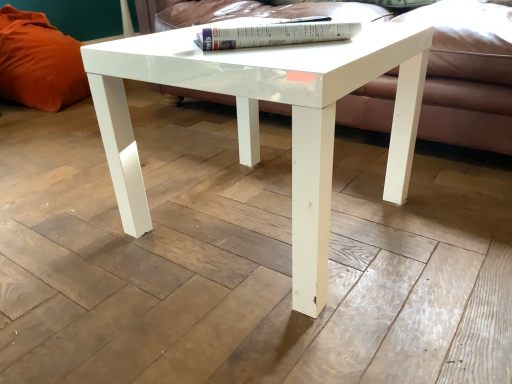
Question: Is matte white couch at center further to camera compared to white glossy book at upper center?

Choices:
 (A) yes
 (B) no

Answer: (A)

Question: From a real-world perspective, is matte white couch at center under white glossy book at upper center?

Choices:
 (A) yes
 (B) no

Answer: (A)

Question: Can you confirm if matte white couch at center is wider than white glossy book at upper center?

Choices:
 (A) yes
 (B) no

Answer: (A)

Question: Can you confirm if matte white couch at center is bigger than white glossy book at upper center?

Choices:
 (A) no
 (B) yes

Answer: (B)

Question: Does matte white couch at center have a smaller size compared to white glossy book at upper center?

Choices:
 (A) no
 (B) yes

Answer: (A)

Question: From the image's perspective, is white glossy book at upper center located above or below matte white couch at center?

Choices:
 (A) above
 (B) below

Answer: (B)

Question: Considering their positions, is white glossy book at upper center located in front of or behind matte white couch at center?

Choices:
 (A) behind
 (B) front

Answer: (B)

Question: In terms of height, does white glossy book at upper center look taller or shorter compared to matte white couch at center?

Choices:
 (A) short
 (B) tall

Answer: (A)

Question: Is point (260, 23) closer or farther from the camera than point (199, 6)?

Choices:
 (A) closer
 (B) farther

Answer: (A)

Question: Looking at the image, does matte white couch at center seem bigger or smaller compared to white glossy book at upper center?

Choices:
 (A) small
 (B) big

Answer: (B)

Question: Considering the relative positions of matte white couch at center and white glossy book at upper center in the image provided, is matte white couch at center to the left or to the right of white glossy book at upper center?

Choices:
 (A) left
 (B) right

Answer: (B)

Question: From the image's perspective, is matte white couch at center positioned above or below white glossy book at upper center?

Choices:
 (A) above
 (B) below

Answer: (A)

Question: From a real-world perspective, relative to white glossy book at upper center, is matte white couch at center vertically above or below?

Choices:
 (A) below
 (B) above

Answer: (A)

Question: From the image's perspective, is white glossy coffee table at center located above or below white glossy book at upper center?

Choices:
 (A) above
 (B) below

Answer: (B)

Question: From a real-world perspective, is white glossy coffee table at center physically located above or below white glossy book at upper center?

Choices:
 (A) below
 (B) above

Answer: (A)